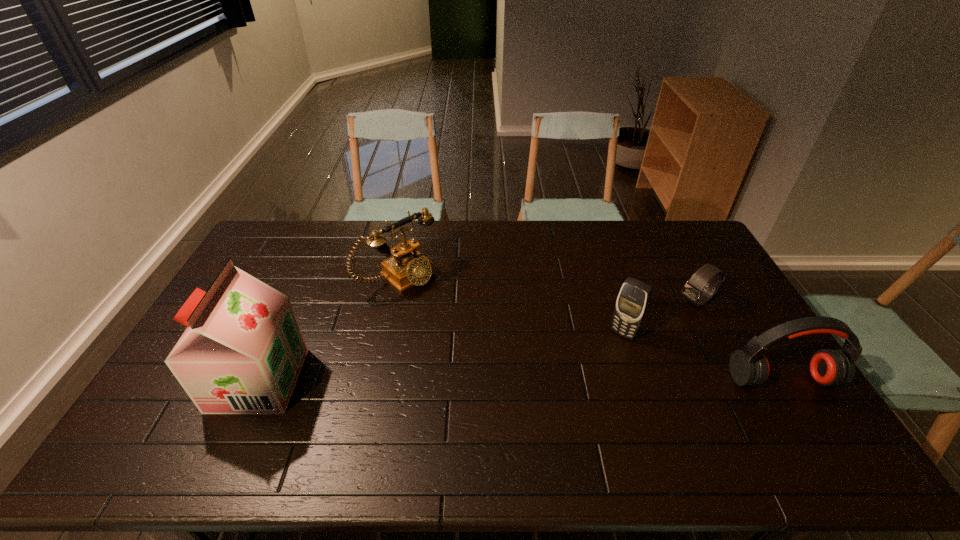
Find the location of `free spot at the far right corner of the desktop`. free spot at the far right corner of the desktop is located at coordinates (690, 230).

Find the location of a particular element. The width and height of the screenshot is (960, 540). vacant space in between the watch and the cellular telephone is located at coordinates (660, 317).

Image resolution: width=960 pixels, height=540 pixels. I want to click on free space between the tallest object and the fourth object from right to left, so click(328, 328).

The width and height of the screenshot is (960, 540). Find the location of `free area in between the fourth object from right to left and the cellular telephone`. free area in between the fourth object from right to left and the cellular telephone is located at coordinates (511, 305).

This screenshot has width=960, height=540. Identify the location of free space between the shortest object and the third nearest object. (660, 317).

This screenshot has width=960, height=540. Find the location of `vacant space in between the watch and the third nearest object`. vacant space in between the watch and the third nearest object is located at coordinates (660, 317).

This screenshot has height=540, width=960. Find the location of `vacant space in between the soya milk and the earphone`. vacant space in between the soya milk and the earphone is located at coordinates (520, 380).

This screenshot has width=960, height=540. In order to click on free space between the watch and the earphone in this screenshot , I will do `click(739, 340)`.

Image resolution: width=960 pixels, height=540 pixels. Identify the location of vacant point located between the telephone and the earphone. (590, 328).

Locate an element on the screen. empty space that is in between the watch and the soya milk is located at coordinates (478, 340).